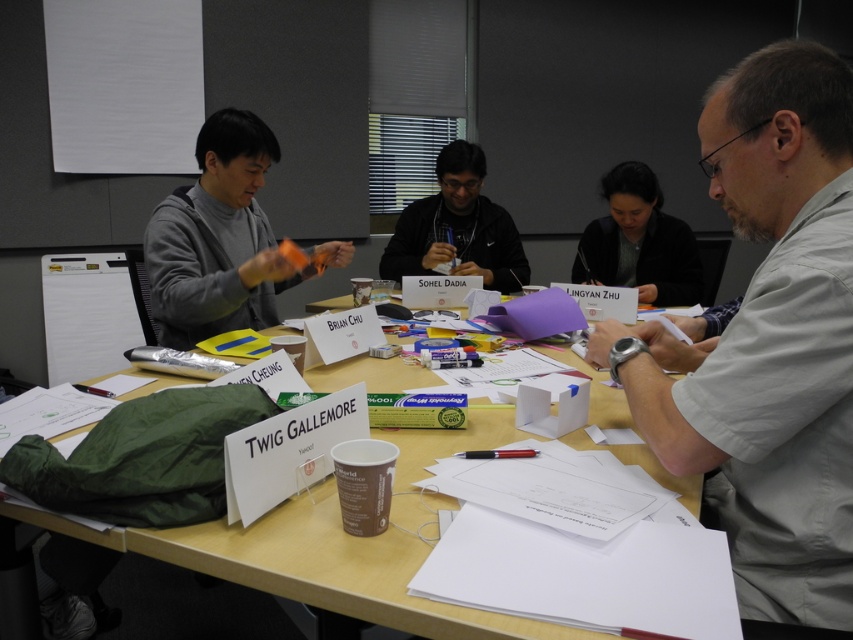
Question: Which point is farther to the camera?

Choices:
 (A) (258, 566)
 (B) (834, 148)
 (C) (573, 266)
 (D) (263, 316)

Answer: (C)

Question: Which object appears closest to the camera in this image?

Choices:
 (A) matte black glasses at center
 (B) wooden table at center
 (C) gray shirt at right

Answer: (B)

Question: Where is wooden table at center located in relation to matte orange plastic at center in the image?

Choices:
 (A) below
 (B) above

Answer: (A)

Question: Is wooden table at center bigger than matte orange plastic at center?

Choices:
 (A) yes
 (B) no

Answer: (A)

Question: Which is nearer to the dark gray sweater at center?

Choices:
 (A) matte orange plastic at center
 (B) gray shirt at right
 (C) matte black glasses at center

Answer: (C)

Question: Can you confirm if wooden table at center is wider than dark gray sweater at center?

Choices:
 (A) yes
 (B) no

Answer: (A)